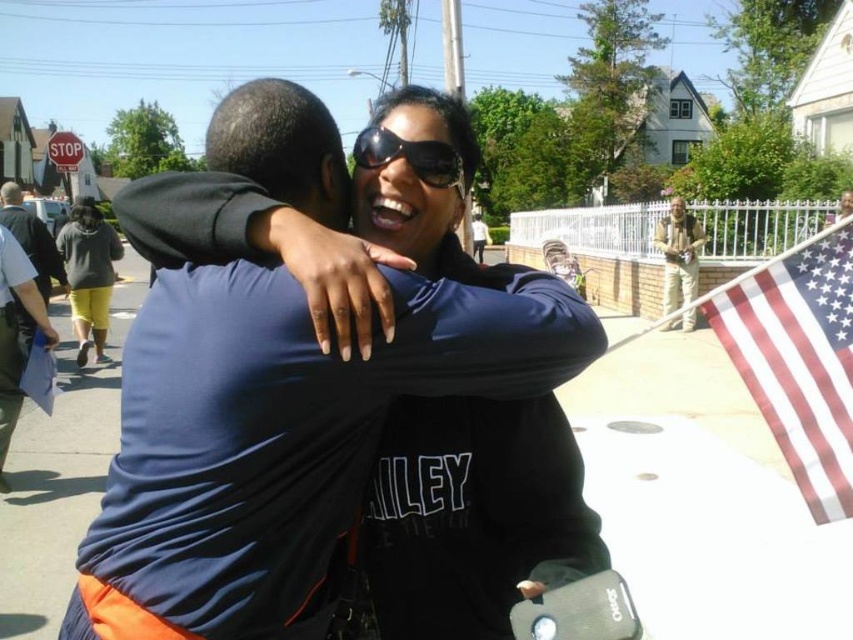
Who is shorter, dark blue shirt at center or red plastic stop sign at upper left?

With less height is red plastic stop sign at upper left.

Find the location of a particular element. dark blue shirt at center is located at coordinates (32, 237).

Which is in front, point (51, 262) or point (70, 170)?

Point (51, 262) is in front.

This screenshot has height=640, width=853. In order to click on dark blue shirt at center in this screenshot , I will do point(32,237).

This screenshot has width=853, height=640. What do you see at coordinates (798, 360) in the screenshot? I see `american flag at right` at bounding box center [798, 360].

Is point (824, 461) positioned after point (445, 166)?

Yes.

Which is behind, point (840, 346) or point (421, 168)?

The point (840, 346) is behind.

At what (x,y) coordinates should I click in order to perform the action: click on american flag at right. Please return your answer as a coordinate pair (x, y). Image resolution: width=853 pixels, height=640 pixels. Looking at the image, I should click on (798, 360).

Is matte black skateboard at center below sunglasses at center?

Yes.

In the scene shown: Between matte black skateboard at center and sunglasses at center, which one has less height?

With less height is sunglasses at center.

This screenshot has width=853, height=640. Identify the location of matte black skateboard at center. (309, 426).

Find the location of a particular element. This screenshot has height=640, width=853. matte black skateboard at center is located at coordinates (309, 426).